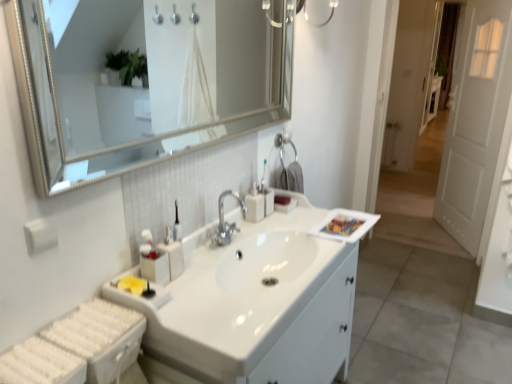
Question: Is white glossy sink at center thinner than satin silver soap dispenser at center?

Choices:
 (A) no
 (B) yes

Answer: (A)

Question: Does white glossy sink at center contain satin silver soap dispenser at center?

Choices:
 (A) yes
 (B) no

Answer: (A)

Question: From a real-world perspective, is white glossy sink at center below satin silver soap dispenser at center?

Choices:
 (A) yes
 (B) no

Answer: (A)

Question: From the image's perspective, is white glossy sink at center located above satin silver soap dispenser at center?

Choices:
 (A) yes
 (B) no

Answer: (B)

Question: Is the position of white glossy sink at center more distant than that of satin silver soap dispenser at center?

Choices:
 (A) no
 (B) yes

Answer: (A)

Question: Is point (462, 147) closer or farther from the camera than point (320, 367)?

Choices:
 (A) farther
 (B) closer

Answer: (A)

Question: Is white wooden door at right bigger or smaller than white glossy sink at center?

Choices:
 (A) big
 (B) small

Answer: (B)

Question: Looking at their shapes, would you say white wooden door at right is wider or thinner than white glossy sink at center?

Choices:
 (A) thin
 (B) wide

Answer: (A)

Question: In the image, is white wooden door at right on the left side or the right side of white glossy sink at center?

Choices:
 (A) left
 (B) right

Answer: (B)

Question: From the image's perspective, is beige plastic soap dispenser at center above or below satin silver soap dispenser at center?

Choices:
 (A) below
 (B) above

Answer: (A)

Question: Choose the correct answer: Is beige plastic soap dispenser at center inside satin silver soap dispenser at center or outside it?

Choices:
 (A) inside
 (B) outside

Answer: (B)

Question: Looking at their shapes, would you say beige plastic soap dispenser at center is wider or thinner than satin silver soap dispenser at center?

Choices:
 (A) thin
 (B) wide

Answer: (B)

Question: Relative to satin silver soap dispenser at center, is beige plastic soap dispenser at center in front or behind?

Choices:
 (A) front
 (B) behind

Answer: (A)

Question: From their relative heights in the image, would you say beige plastic soap dispenser at center is taller or shorter than white glossy sink at center?

Choices:
 (A) short
 (B) tall

Answer: (A)

Question: Looking at their shapes, would you say beige plastic soap dispenser at center is wider or thinner than white glossy sink at center?

Choices:
 (A) thin
 (B) wide

Answer: (A)